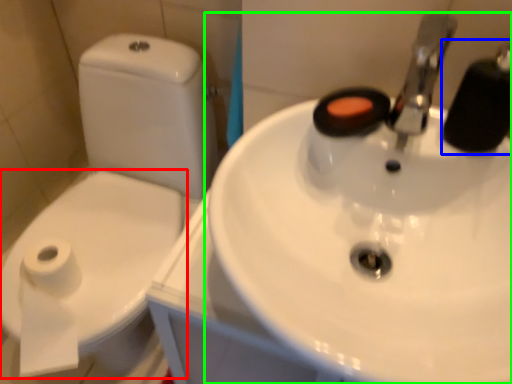
Question: Which is farther away from bidet (highlighted by a red box)? plumbing fixture (highlighted by a blue box) or sink (highlighted by a green box)?

Choices:
 (A) plumbing fixture
 (B) sink

Answer: (A)